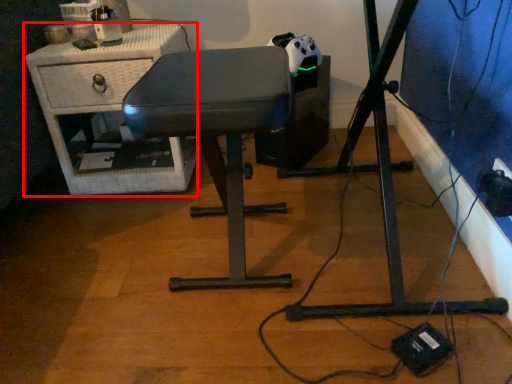
Question: From the image's perspective, where is furniture (annotated by the red box) located relative to furniture?

Choices:
 (A) below
 (B) above

Answer: (B)